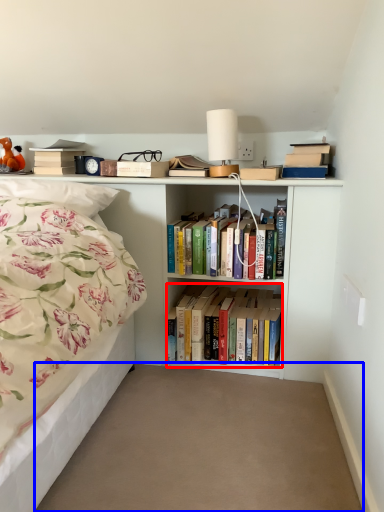
Question: Which object is further to the camera taking this photo, book (highlighted by a red box) or plain (highlighted by a blue box)?

Choices:
 (A) book
 (B) plain

Answer: (A)